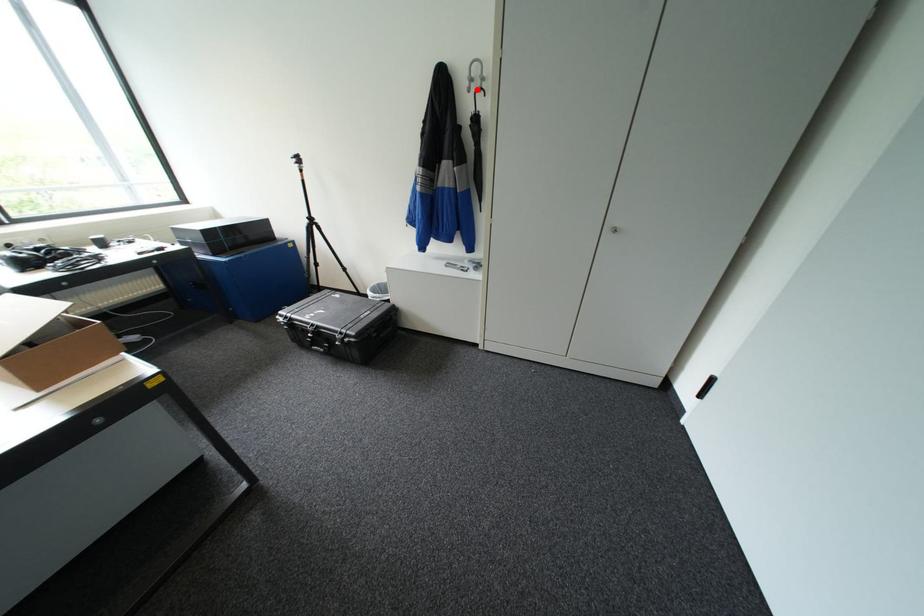
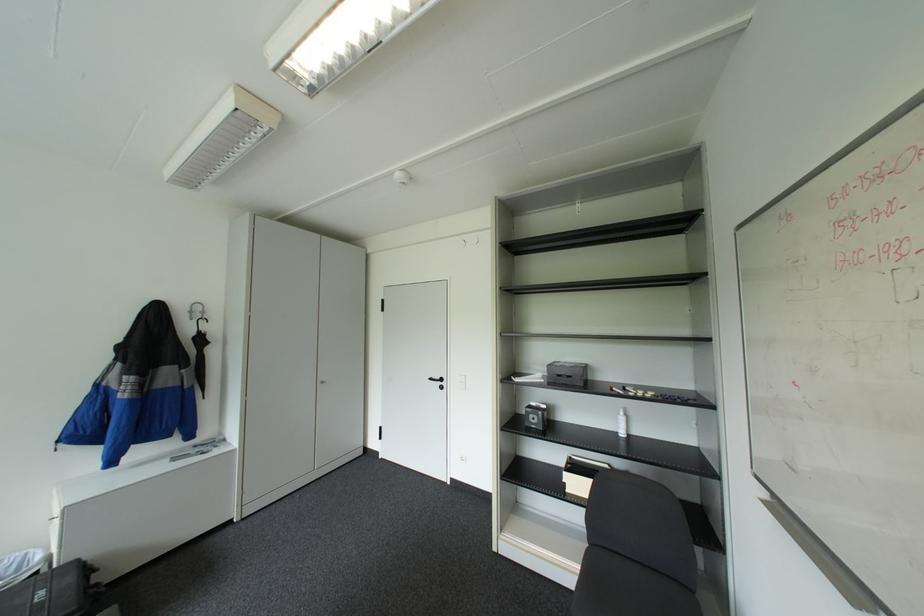
Question: I am providing you with two images of the same scene from different viewpoints. A red point is marked on the first image. At the location where the point appears in image 1, is it still visible in image 2?

Choices:
 (A) Yes
 (B) No

Answer: (A)